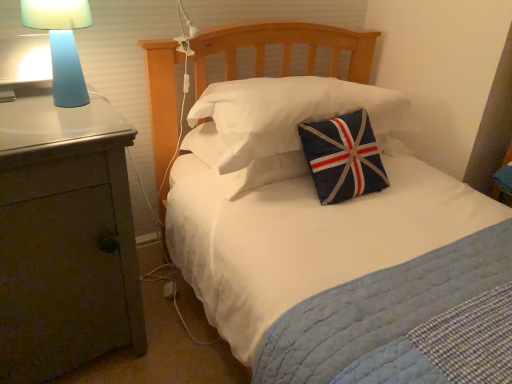
Question: Considering the relative sizes of blue matte lamp at left and matte gray nightstand at left in the image provided, is blue matte lamp at left wider than matte gray nightstand at left?

Choices:
 (A) yes
 (B) no

Answer: (B)

Question: Does blue matte lamp at left appear on the right side of matte gray nightstand at left?

Choices:
 (A) yes
 (B) no

Answer: (A)

Question: Is blue matte lamp at left taller than matte gray nightstand at left?

Choices:
 (A) no
 (B) yes

Answer: (A)

Question: From the image's perspective, would you say blue matte lamp at left is positioned over matte gray nightstand at left?

Choices:
 (A) no
 (B) yes

Answer: (B)

Question: Is blue matte lamp at left positioned before matte gray nightstand at left?

Choices:
 (A) no
 (B) yes

Answer: (A)

Question: From a real-world perspective, is blue matte lamp at left physically located above or below navy blue fabric pillow at center, which appears as the 2th pillow when ordered from the bottom?

Choices:
 (A) below
 (B) above

Answer: (B)

Question: From the image's perspective, relative to navy blue fabric pillow at center, which appears as the 2th pillow when ordered from the bottom, is blue matte lamp at left above or below?

Choices:
 (A) above
 (B) below

Answer: (A)

Question: Considering the positions of point (39, 8) and point (245, 142), is point (39, 8) closer or farther from the camera than point (245, 142)?

Choices:
 (A) farther
 (B) closer

Answer: (B)

Question: Do you think blue matte lamp at left is within navy blue fabric pillow at center, which appears as the 2th pillow when ordered from the bottom, or outside of it?

Choices:
 (A) inside
 (B) outside

Answer: (B)

Question: Looking at the image, does matte gray nightstand at left seem bigger or smaller compared to blue matte lamp at left?

Choices:
 (A) small
 (B) big

Answer: (B)

Question: From a real-world perspective, is matte gray nightstand at left positioned above or below blue matte lamp at left?

Choices:
 (A) above
 (B) below

Answer: (B)

Question: Is matte gray nightstand at left situated inside blue matte lamp at left or outside?

Choices:
 (A) outside
 (B) inside

Answer: (A)

Question: From the image's perspective, is matte gray nightstand at left located above or below blue matte lamp at left?

Choices:
 (A) above
 (B) below

Answer: (B)

Question: Choose the correct answer: Is blue fabric pillow at center, marked as the 1th pillow in a bottom-to-top arrangement, inside matte gray nightstand at left or outside it?

Choices:
 (A) inside
 (B) outside

Answer: (B)

Question: Is blue fabric pillow at center, marked as the 1th pillow in a bottom-to-top arrangement, taller or shorter than matte gray nightstand at left?

Choices:
 (A) tall
 (B) short

Answer: (B)